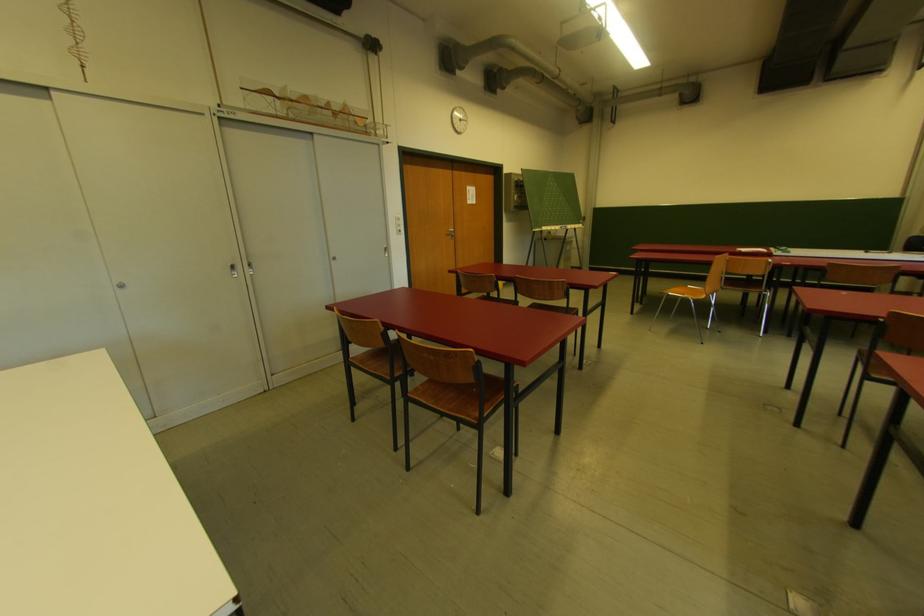
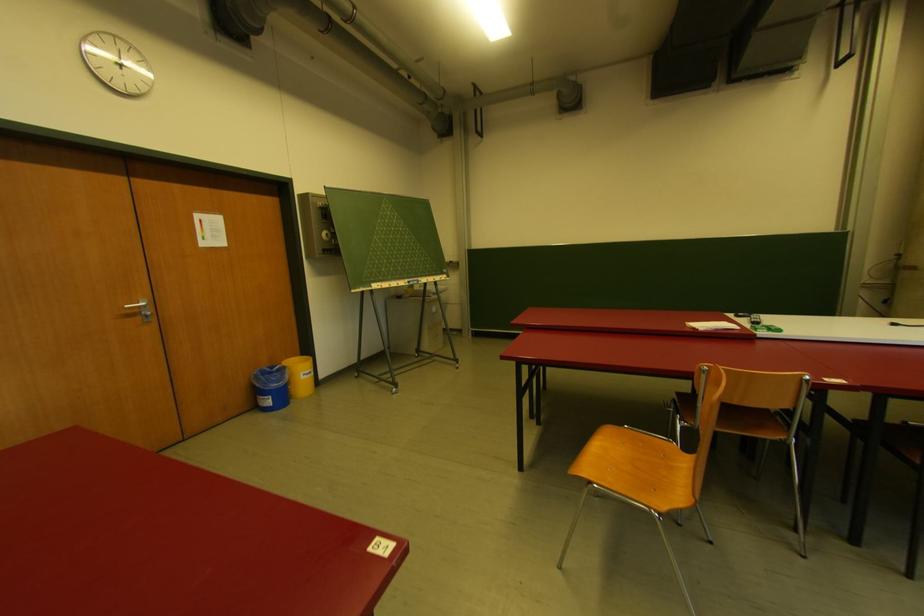
Find the pixel in the second image that matches point 517,208 in the first image.

(326, 252)